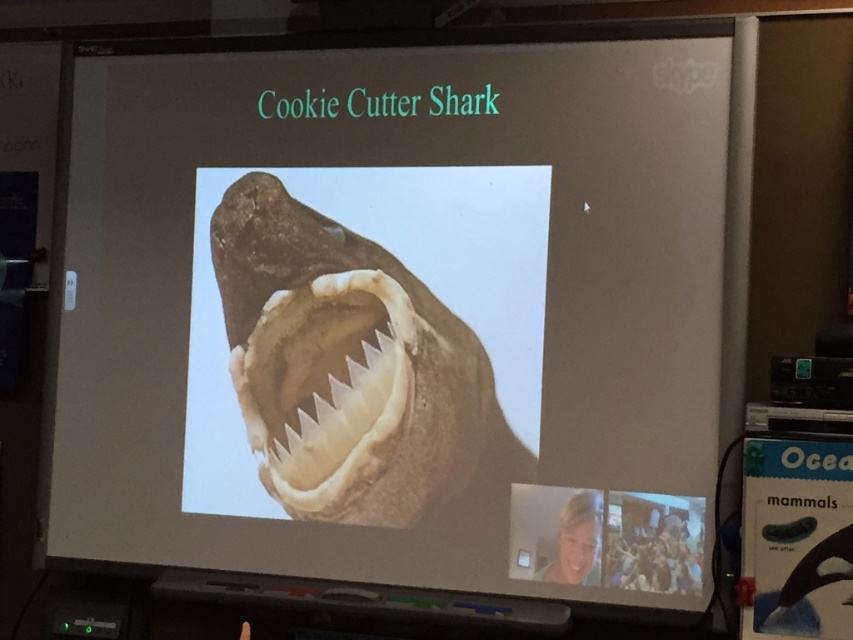
You are a GUI agent. You are given a task and a screenshot of the screen. Output one action in this format:
    pyautogui.click(x=<x>, y=<y>)
    Task: Click on the brown rough cookie cutter shark at center
    
    Given the screenshot: What is the action you would take?
    pyautogui.click(x=346, y=365)

Is brown rough cookie cutter shark at center shorter than white glossy teeth at center?

No, brown rough cookie cutter shark at center is not shorter than white glossy teeth at center.

Where is `brown rough cookie cutter shark at center`? This screenshot has width=853, height=640. brown rough cookie cutter shark at center is located at coordinates (346, 365).

Find the location of a particular element. The width and height of the screenshot is (853, 640). brown rough cookie cutter shark at center is located at coordinates (346, 365).